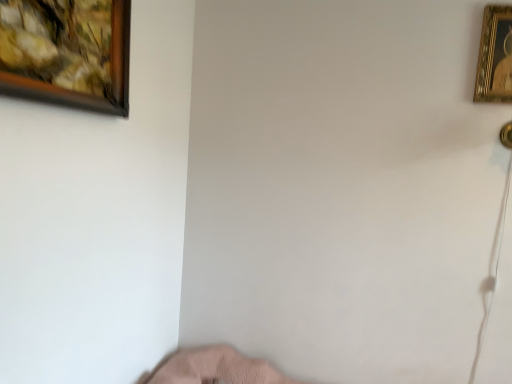
Image resolution: width=512 pixels, height=384 pixels. Identify the location of gold metallic picture frame at upper right, which is the 1th picture frame in back-to-front order. (495, 57).

What do you see at coordinates (495, 57) in the screenshot? This screenshot has height=384, width=512. I see `gold metallic picture frame at upper right, which is the 1th picture frame in back-to-front order` at bounding box center [495, 57].

The image size is (512, 384). What do you see at coordinates (67, 52) in the screenshot?
I see `wooden framed painting at upper left, which ranks as the second picture frame in right-to-left order` at bounding box center [67, 52].

What is the approximate height of wooden framed painting at upper left, which is the 1th picture frame in front-to-back order?

The height of wooden framed painting at upper left, which is the 1th picture frame in front-to-back order, is 16.28 inches.

In order to click on wooden framed painting at upper left, which is the 1th picture frame in front-to-back order in this screenshot , I will do [x=67, y=52].

The image size is (512, 384). Find the location of `gold metallic picture frame at upper right, the second picture frame in the front-to-back sequence`. gold metallic picture frame at upper right, the second picture frame in the front-to-back sequence is located at coordinates (495, 57).

From the picture: Which is more to the left, gold metallic picture frame at upper right, marked as the first picture frame in a right-to-left arrangement, or wooden framed painting at upper left, positioned as the 2th picture frame in back-to-front order?

From the viewer's perspective, wooden framed painting at upper left, positioned as the 2th picture frame in back-to-front order, appears more on the left side.

Considering the relative positions of gold metallic picture frame at upper right, which is the 1th picture frame in back-to-front order, and wooden framed painting at upper left, which is the first picture frame in left-to-right order, in the image provided, is gold metallic picture frame at upper right, which is the 1th picture frame in back-to-front order, in front of wooden framed painting at upper left, which is the first picture frame in left-to-right order,?

No, gold metallic picture frame at upper right, which is the 1th picture frame in back-to-front order, is further to the viewer.

Is point (495, 102) closer or farther from the camera than point (124, 14)?

Point (495, 102) is farther from the camera than point (124, 14).

From the image's perspective, is gold metallic picture frame at upper right, which is counted as the second picture frame, starting from the left, over wooden framed painting at upper left, positioned as the 2th picture frame in back-to-front order?

Correct, gold metallic picture frame at upper right, which is counted as the second picture frame, starting from the left, appears higher than wooden framed painting at upper left, positioned as the 2th picture frame in back-to-front order, in the image.

From a real-world perspective, is gold metallic picture frame at upper right, marked as the first picture frame in a right-to-left arrangement, positioned above or below wooden framed painting at upper left, which ranks as the second picture frame in right-to-left order?

In terms of real-world spatial position, gold metallic picture frame at upper right, marked as the first picture frame in a right-to-left arrangement, is above wooden framed painting at upper left, which ranks as the second picture frame in right-to-left order.

Considering the sizes of objects gold metallic picture frame at upper right, marked as the first picture frame in a right-to-left arrangement, and wooden framed painting at upper left, positioned as the 2th picture frame in back-to-front order, in the image provided, who is wider, gold metallic picture frame at upper right, marked as the first picture frame in a right-to-left arrangement, or wooden framed painting at upper left, positioned as the 2th picture frame in back-to-front order,?

wooden framed painting at upper left, positioned as the 2th picture frame in back-to-front order, is wider.

Between gold metallic picture frame at upper right, which is counted as the second picture frame, starting from the left, and wooden framed painting at upper left, positioned as the 2th picture frame in back-to-front order, which one has more height?

gold metallic picture frame at upper right, which is counted as the second picture frame, starting from the left, is taller.

Between gold metallic picture frame at upper right, which is the 1th picture frame in back-to-front order, and wooden framed painting at upper left, positioned as the 2th picture frame in back-to-front order, which one has larger size?

With larger size is wooden framed painting at upper left, positioned as the 2th picture frame in back-to-front order.

Choose the correct answer: Is gold metallic picture frame at upper right, marked as the first picture frame in a right-to-left arrangement, inside wooden framed painting at upper left, which is the first picture frame in left-to-right order, or outside it?

gold metallic picture frame at upper right, marked as the first picture frame in a right-to-left arrangement, is located beyond the bounds of wooden framed painting at upper left, which is the first picture frame in left-to-right order.

Is gold metallic picture frame at upper right, marked as the first picture frame in a right-to-left arrangement, not close to wooden framed painting at upper left, which ranks as the second picture frame in right-to-left order?

Yes, gold metallic picture frame at upper right, marked as the first picture frame in a right-to-left arrangement, is far from wooden framed painting at upper left, which ranks as the second picture frame in right-to-left order.

Is gold metallic picture frame at upper right, which is the 1th picture frame in back-to-front order, facing towards wooden framed painting at upper left, positioned as the 2th picture frame in back-to-front order?

No, gold metallic picture frame at upper right, which is the 1th picture frame in back-to-front order, is not facing towards wooden framed painting at upper left, positioned as the 2th picture frame in back-to-front order.

What's the angular difference between gold metallic picture frame at upper right, which is counted as the second picture frame, starting from the left, and wooden framed painting at upper left, which ranks as the second picture frame in right-to-left order,'s facing directions?

There is a 90-degree angle between the facing directions of gold metallic picture frame at upper right, which is counted as the second picture frame, starting from the left, and wooden framed painting at upper left, which ranks as the second picture frame in right-to-left order.

In the scene shown: Measure the distance from gold metallic picture frame at upper right, marked as the first picture frame in a right-to-left arrangement, to wooden framed painting at upper left, which is the 1th picture frame in front-to-back order.

1.62 meters.

The image size is (512, 384). Identify the location of picture frame in front of the gold metallic picture frame at upper right, which is counted as the second picture frame, starting from the left. (67, 52).

Considering the positions of objects wooden framed painting at upper left, which ranks as the second picture frame in right-to-left order, and gold metallic picture frame at upper right, the second picture frame in the front-to-back sequence, in the image provided, who is more to the right, wooden framed painting at upper left, which ranks as the second picture frame in right-to-left order, or gold metallic picture frame at upper right, the second picture frame in the front-to-back sequence,?

gold metallic picture frame at upper right, the second picture frame in the front-to-back sequence.

Which is behind, wooden framed painting at upper left, which is the 1th picture frame in front-to-back order, or gold metallic picture frame at upper right, which is counted as the second picture frame, starting from the left?

gold metallic picture frame at upper right, which is counted as the second picture frame, starting from the left, is further from the camera.

Which is closer to the camera, (x=114, y=8) or (x=506, y=96)?

The point (x=114, y=8) is more forward.

From the image's perspective, is wooden framed painting at upper left, which is the first picture frame in left-to-right order, located beneath gold metallic picture frame at upper right, which is the 1th picture frame in back-to-front order?

Yes, from the image's perspective, wooden framed painting at upper left, which is the first picture frame in left-to-right order, is below gold metallic picture frame at upper right, which is the 1th picture frame in back-to-front order.

From a real-world perspective, which object stands above the other?

In real-world perspective, gold metallic picture frame at upper right, which is the 1th picture frame in back-to-front order, is above.

Does wooden framed painting at upper left, which is the 1th picture frame in front-to-back order, have a greater width compared to gold metallic picture frame at upper right, marked as the first picture frame in a right-to-left arrangement?

Yes.

Considering the sizes of objects wooden framed painting at upper left, positioned as the 2th picture frame in back-to-front order, and gold metallic picture frame at upper right, the second picture frame in the front-to-back sequence, in the image provided, who is shorter, wooden framed painting at upper left, positioned as the 2th picture frame in back-to-front order, or gold metallic picture frame at upper right, the second picture frame in the front-to-back sequence,?

wooden framed painting at upper left, positioned as the 2th picture frame in back-to-front order.

Does wooden framed painting at upper left, which ranks as the second picture frame in right-to-left order, have a larger size compared to gold metallic picture frame at upper right, which is the 1th picture frame in back-to-front order?

Yes.

Is wooden framed painting at upper left, positioned as the 2th picture frame in back-to-front order, situated inside gold metallic picture frame at upper right, which is the 1th picture frame in back-to-front order, or outside?

wooden framed painting at upper left, positioned as the 2th picture frame in back-to-front order, cannot be found inside gold metallic picture frame at upper right, which is the 1th picture frame in back-to-front order.

Looking at this image, are wooden framed painting at upper left, which is the first picture frame in left-to-right order, and gold metallic picture frame at upper right, which is counted as the second picture frame, starting from the left, far apart?

That's right, there is a large distance between wooden framed painting at upper left, which is the first picture frame in left-to-right order, and gold metallic picture frame at upper right, which is counted as the second picture frame, starting from the left.

Could you tell me if wooden framed painting at upper left, which ranks as the second picture frame in right-to-left order, is facing gold metallic picture frame at upper right, marked as the first picture frame in a right-to-left arrangement?

No, wooden framed painting at upper left, which ranks as the second picture frame in right-to-left order, is not aimed at gold metallic picture frame at upper right, marked as the first picture frame in a right-to-left arrangement.

Locate an element on the screen. The height and width of the screenshot is (384, 512). picture frame in front of the gold metallic picture frame at upper right, which is counted as the second picture frame, starting from the left is located at coordinates (67, 52).

Locate an element on the screen. picture frame behind the wooden framed painting at upper left, which is the first picture frame in left-to-right order is located at coordinates (495, 57).

I want to click on picture frame in front of the gold metallic picture frame at upper right, which is counted as the second picture frame, starting from the left, so click(67, 52).